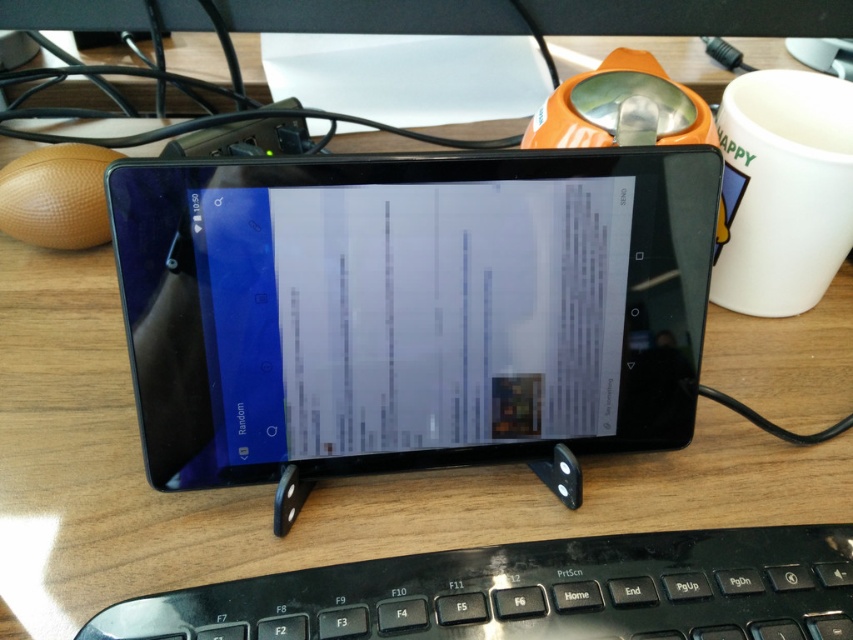
You are an office worker trying to locate two specific points on your desk. The first point is at coordinates point (848,637) and the second is at point (764,180). From your perspective sitting at the desk, which point is closer to you?

Point (848,637) is in front of point (764,180), so the first point is closer to you.

You are a delivery robot positioned at the edge of the desk. Your task is to deliver a small package to the black plastic keyboard at lower center. The robot has a maximum reach of 30 centimeters. Can you reach the keyboard without moving?

The black plastic keyboard at lower center is 32.81 centimeters away from the camera. Since the robot can only reach up to 30 centimeters, it cannot reach the keyboard without moving.

You are a robot arm trying to pick up the black plastic keyboard at lower center. What are the coordinates you should move to in order to reach it?

The black plastic keyboard at lower center is located at coordinates point (531,593).